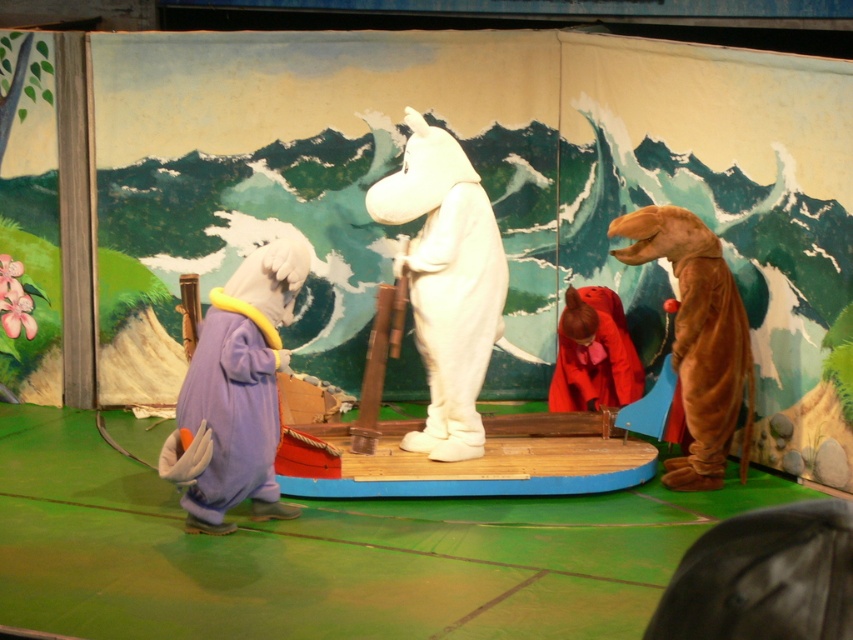
Consider the image. You are an audience member sitting in the front row of the puppet show. You notice the purple plush elephant at left and the velvet red robe at center. Which character is closer to you?

The purple plush elephant at left is closer to the viewer than the velvet red robe at center.

You are a stagehand who needs to move the white plush unicorn at center closer to the rabbit on the left. How much distance do you need to cover to bring them together?

The distance between the white plush unicorn at center and the rabbit on the left is 7.57 meters, so you need to cover 7.57 meters to bring them together.